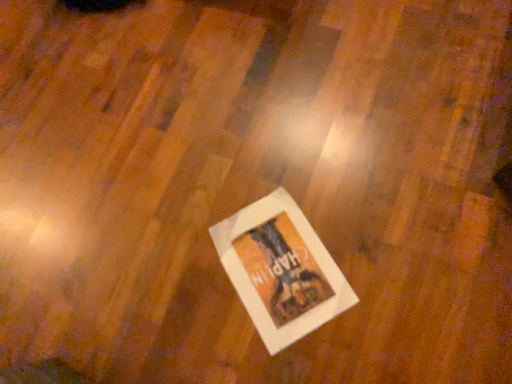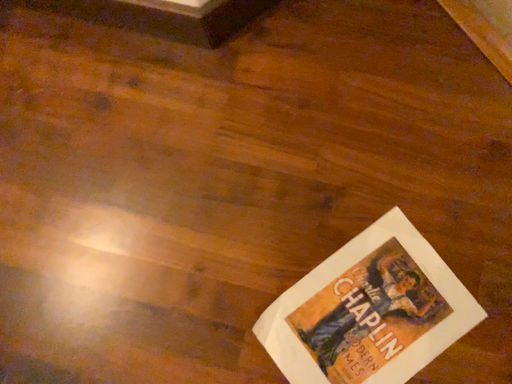
Question: How did the camera likely rotate when shooting the video?

Choices:
 (A) rotated right
 (B) rotated left

Answer: (A)